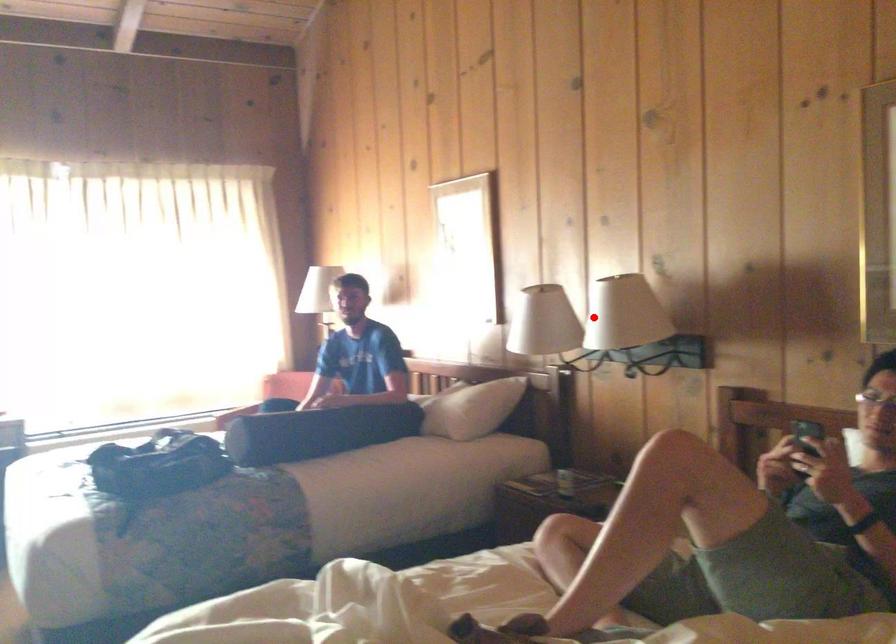
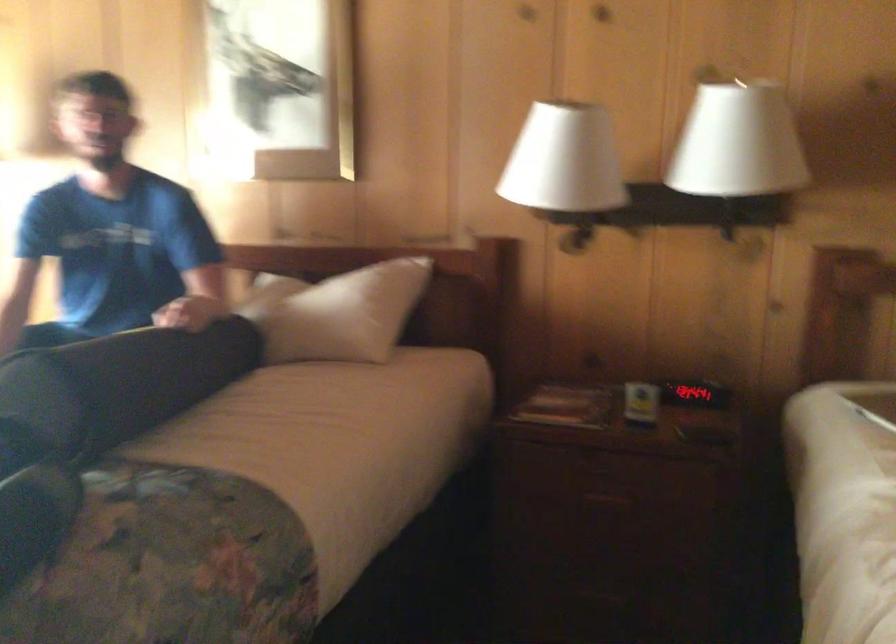
Find the pixel in the second image that matches the highlighted location in the first image.

(737, 143)